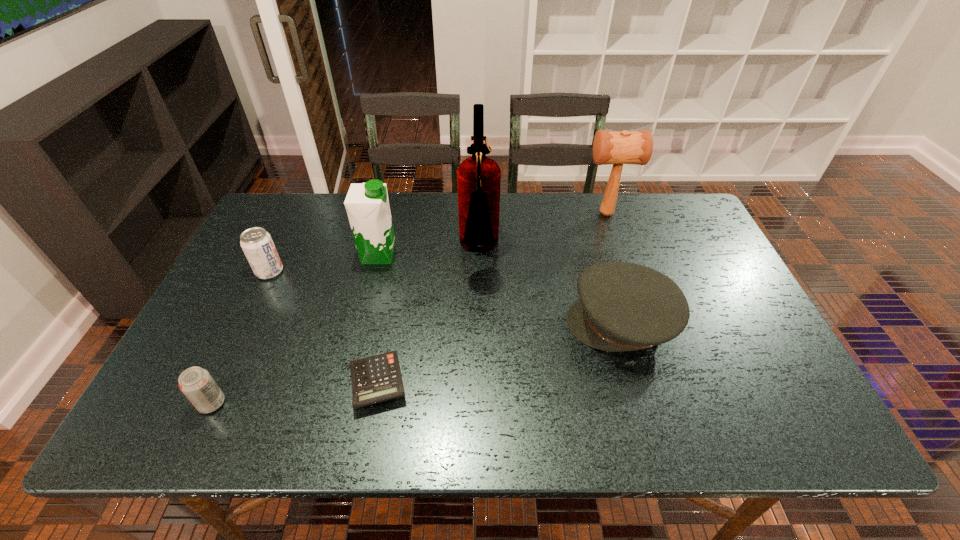
The width and height of the screenshot is (960, 540). What are the coordinates of `the fifth object from left to right` in the screenshot? It's located at (478, 177).

Identify the location of fire extinguisher. This screenshot has height=540, width=960. (478, 177).

Where is `mallet`? mallet is located at coordinates (609, 147).

Locate an element on the screen. the third tallest object is located at coordinates (367, 204).

The image size is (960, 540). What are the coordinates of `the farther soda can` in the screenshot? It's located at (256, 243).

Find the location of a particular element. This screenshot has height=540, width=960. beret is located at coordinates (622, 306).

The image size is (960, 540). Identify the location of the second shortest object. (196, 383).

You are a GUI agent. You are given a task and a screenshot of the screen. Output one action in this format:
    pyautogui.click(x=<x>, y=<y>)
    Task: Click on the nearer soda can
    The height and width of the screenshot is (540, 960).
    Given the screenshot: What is the action you would take?
    pyautogui.click(x=196, y=383)

The image size is (960, 540). Find the location of `calculator`. calculator is located at coordinates (377, 378).

Image resolution: width=960 pixels, height=540 pixels. Find the location of `vacant space located at the nozzle of the tallest object`. vacant space located at the nozzle of the tallest object is located at coordinates (634, 250).